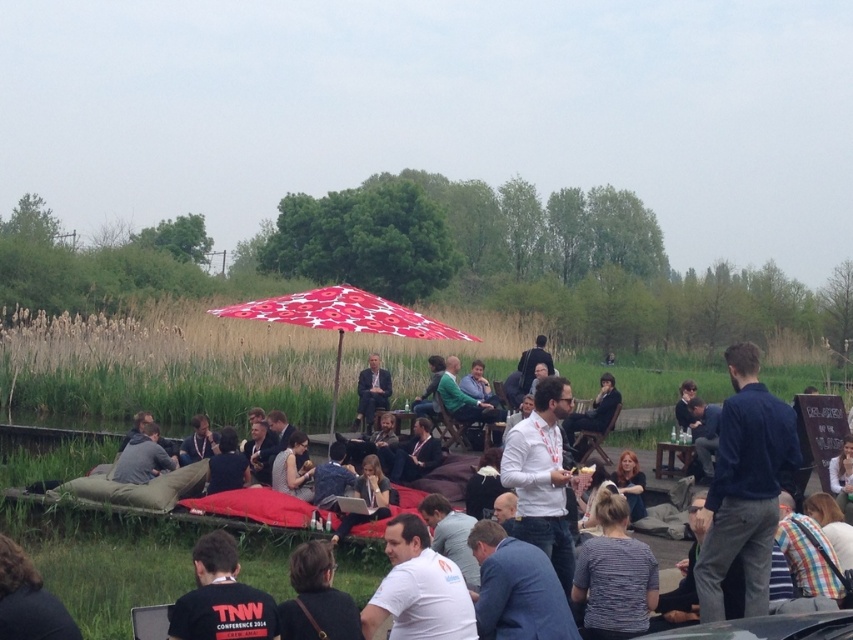
Who is taller, dark blue shirt at center or white cotton shirt at center?

Standing taller between the two is dark blue shirt at center.

This screenshot has height=640, width=853. Describe the element at coordinates (744, 486) in the screenshot. I see `dark blue shirt at center` at that location.

In order to click on dark blue shirt at center in this screenshot , I will do `click(744, 486)`.

The image size is (853, 640). Describe the element at coordinates (418, 588) in the screenshot. I see `white cotton shirt at center` at that location.

Does point (444, 618) come farther from viewer compared to point (204, 570)?

Yes, it is.

Is point (404, 579) in front of point (210, 561)?

No, (404, 579) is behind (210, 561).

Image resolution: width=853 pixels, height=640 pixels. I want to click on white cotton shirt at center, so click(418, 588).

Is dark blue shirt at center thinner than red printed fabric umbrella at center?

Yes.

Is point (767, 536) positioned after point (358, 321)?

No, it is in front of (358, 321).

Where is `dark blue shirt at center`? Image resolution: width=853 pixels, height=640 pixels. dark blue shirt at center is located at coordinates (744, 486).

What are the coordinates of `dark blue shirt at center` in the screenshot? It's located at (744, 486).